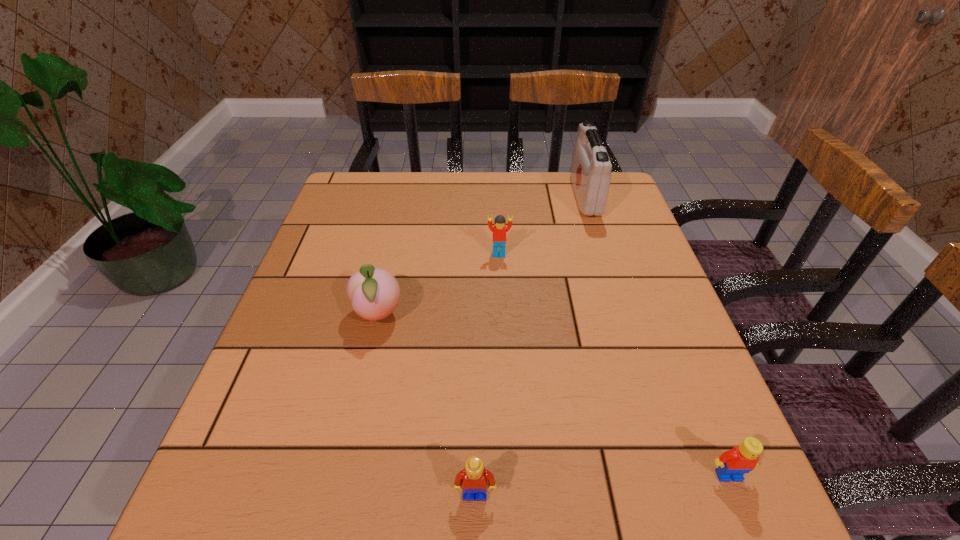
Where is `free spot that satisfies the following two spatial constraints: 1. on the front side of the tallest object; 2. on the front-facing side of the nearest object`? The image size is (960, 540). free spot that satisfies the following two spatial constraints: 1. on the front side of the tallest object; 2. on the front-facing side of the nearest object is located at coordinates (679, 494).